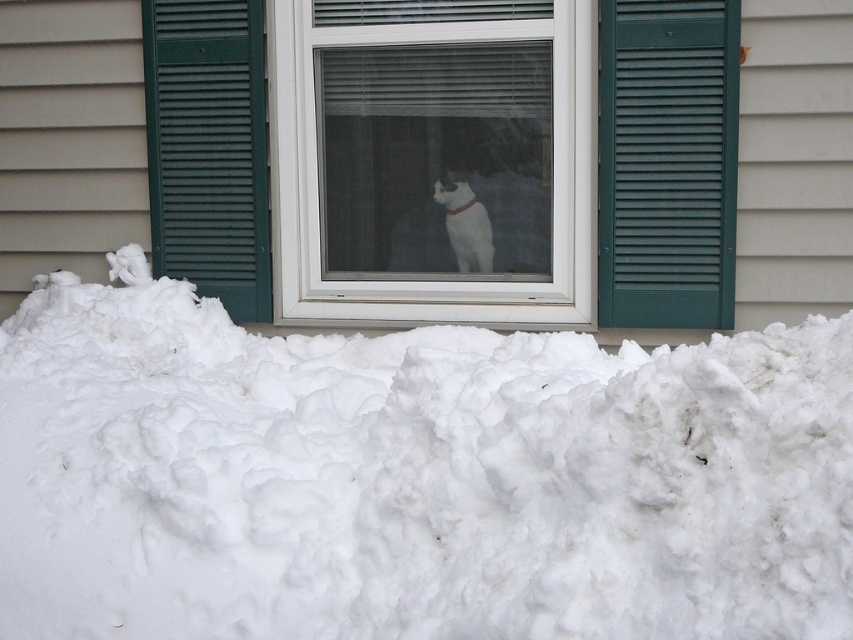
Question: Is green painted wood shutter at right to the left of white fur dog at center from the viewer's perspective?

Choices:
 (A) yes
 (B) no

Answer: (B)

Question: Which point is farther to the camera?

Choices:
 (A) green painted wood shutter at right
 (B) white fur dog at center

Answer: (B)

Question: Is white plastic window at center in front of white fur dog at center?

Choices:
 (A) no
 (B) yes

Answer: (B)

Question: Which point is closer to the camera taking this photo?

Choices:
 (A) (252, 176)
 (B) (651, 108)
 (C) (364, 173)
 (D) (456, 250)

Answer: (B)

Question: Is green louvered shutter at center to the right of white fur dog at center from the viewer's perspective?

Choices:
 (A) no
 (B) yes

Answer: (A)

Question: Which of these objects is positioned closest to the green painted wood shutter at right?

Choices:
 (A) white fur dog at center
 (B) white fluffy snow at center

Answer: (A)